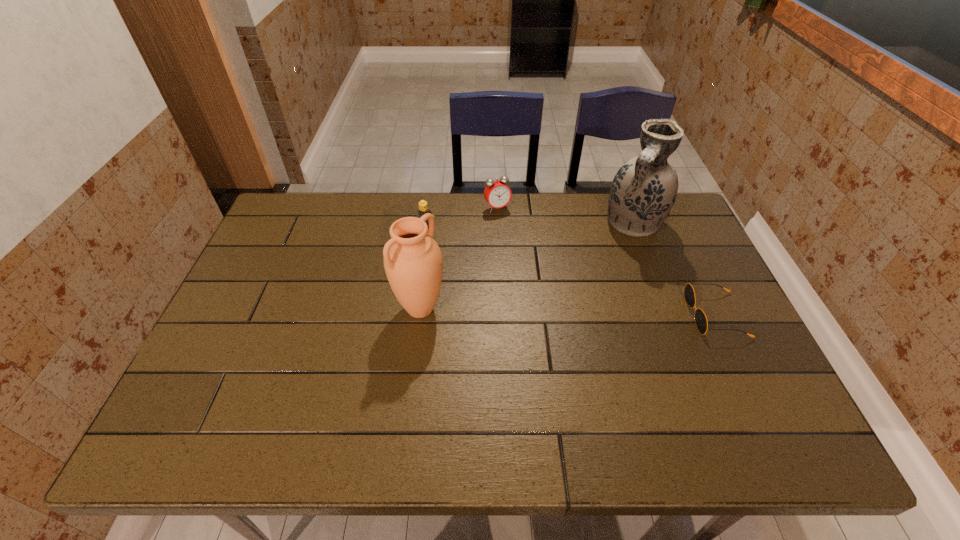
At what (x,y) coordinates should I click in order to perform the action: click on vacant area between the tallest object and the fourth shortest object. Please return your answer as a coordinate pair (x, y). Looking at the image, I should click on (527, 266).

The image size is (960, 540). Identify the location of vacant point located between the sunglasses and the vase. (675, 269).

Where is `vacant point located between the vase and the Lego`? The image size is (960, 540). vacant point located between the vase and the Lego is located at coordinates click(x=530, y=227).

Where is `free space between the Lego and the vase`? Image resolution: width=960 pixels, height=540 pixels. free space between the Lego and the vase is located at coordinates (530, 227).

You are a GUI agent. You are given a task and a screenshot of the screen. Output one action in this format:
    pyautogui.click(x=<x>, y=<y>)
    Task: Click on the free spot between the sunglasses and the alarm clock
    The image size is (960, 540).
    Given the screenshot: What is the action you would take?
    pyautogui.click(x=607, y=261)

Where is `empty space that is in between the shortest object and the Lego`? The image size is (960, 540). empty space that is in between the shortest object and the Lego is located at coordinates (571, 273).

What are the coordinates of `vacant area between the Lego and the alarm clock` in the screenshot? It's located at (462, 219).

Find the location of a particular element. This screenshot has height=540, width=960. free spot between the second tallest object and the sunglasses is located at coordinates 567,312.

The image size is (960, 540). What are the coordinates of `free space between the sunglasses and the tallest object` in the screenshot? It's located at (675, 269).

Select which object is the second closest to the shortest object. Please provide its 2D coordinates. Your answer should be formatted as a tuple, i.e. [(x, y)], where the tuple contains the x and y coordinates of a point satisfying the conditions above.

[(497, 193)]